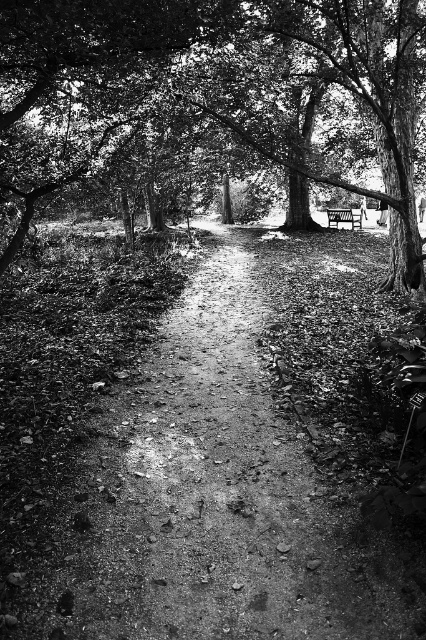
Can you confirm if dirt path at center is thinner than smooth bark tree at center?

Yes, dirt path at center is thinner than smooth bark tree at center.

Between point (267, 605) and point (143, 124), which one is positioned behind?

The point (143, 124) is more distant.

Who is more forward, (x=212, y=502) or (x=69, y=156)?

Point (x=212, y=502)

Find the location of a particular element. dirt path at center is located at coordinates (218, 484).

Who is shorter, dirt path at center or wooden bench at center?

Standing shorter between the two is dirt path at center.

You are a GUI agent. You are given a task and a screenshot of the screen. Output one action in this format:
    pyautogui.click(x=<x>, y=<y>)
    Task: Click on the dirt path at center
    The image size is (426, 640).
    Given the screenshot: What is the action you would take?
    pyautogui.click(x=218, y=484)

Describe the element at coordinates (218, 484) in the screenshot. The width and height of the screenshot is (426, 640). I see `dirt path at center` at that location.

At what (x,y) coordinates should I click in order to perform the action: click on dirt path at center. Please return your answer as a coordinate pair (x, y). Looking at the image, I should click on (218, 484).

Between smooth bark tree at center and wooden bench at center, which one appears on the left side from the viewer's perspective?

From the viewer's perspective, smooth bark tree at center appears more on the left side.

Between smooth bark tree at center and wooden bench at center, which one has more height?

Standing taller between the two is smooth bark tree at center.

What do you see at coordinates (204, 90) in the screenshot?
I see `smooth bark tree at center` at bounding box center [204, 90].

You are a GUI agent. You are given a task and a screenshot of the screen. Output one action in this format:
    pyautogui.click(x=<x>, y=<y>)
    Task: Click on the smooth bark tree at center
    The image size is (426, 640).
    Given the screenshot: What is the action you would take?
    pyautogui.click(x=204, y=90)